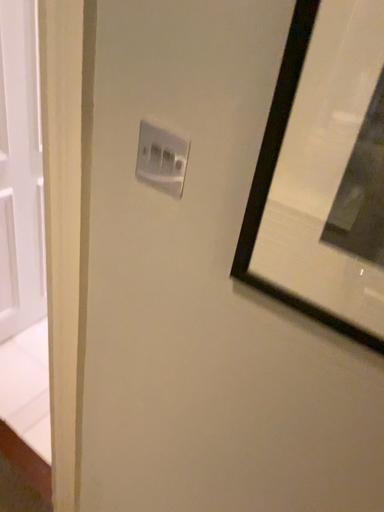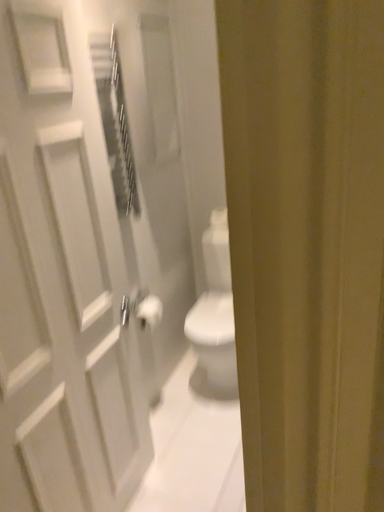
Question: How did the camera likely rotate when shooting the video?

Choices:
 (A) rotated upward
 (B) rotated downward

Answer: (A)